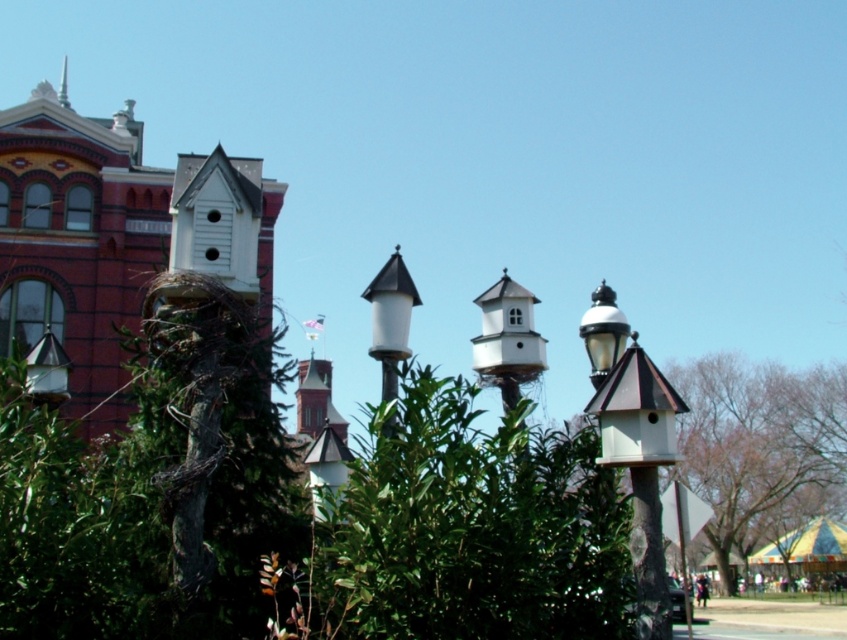
Is the position of green leafy tree at lower right more distant than that of green metallic spire at upper left?

Yes, green leafy tree at lower right is behind green metallic spire at upper left.

Based on the photo, who is more distant from viewer, (828, 442) or (65, 74)?

Positioned behind is point (65, 74).

Identify the location of green leafy tree at lower right. (759, 445).

Is green leafy tree at lower right closer to the viewer compared to white glossy lamp post at center?

That is False.

Where is `green leafy tree at lower right`? green leafy tree at lower right is located at coordinates (759, 445).

Based on the photo, who is more distant from viewer, [718,428] or [396,308]?

Positioned behind is point [718,428].

Image resolution: width=847 pixels, height=640 pixels. Identify the location of green leafy tree at lower right. (759, 445).

Is green leafy bush at center below white glossy lamp post at center?

Correct, green leafy bush at center is located below white glossy lamp post at center.

The height and width of the screenshot is (640, 847). What are the coordinates of `green leafy bush at center` in the screenshot? It's located at (469, 529).